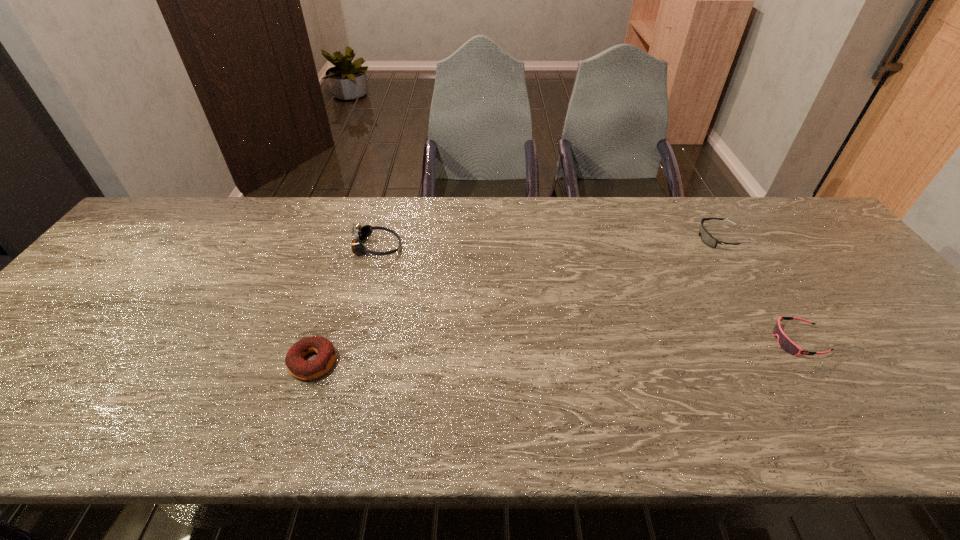
Locate an element on the screen. The width and height of the screenshot is (960, 540). free space between the doughnut and the leftmost goggles is located at coordinates (345, 305).

Identify the location of object that is the second nearest to the shortest goggles. (361, 232).

Where is `the second closest object to the tallest object`? This screenshot has height=540, width=960. the second closest object to the tallest object is located at coordinates (706, 237).

Where is `goggles that stands as the closest to the nearest goggles`? Image resolution: width=960 pixels, height=540 pixels. goggles that stands as the closest to the nearest goggles is located at coordinates pos(706,237).

At what (x,y) coordinates should I click in order to perform the action: click on goggles that stands as the closest to the tallest object. Please return your answer as a coordinate pair (x, y). This screenshot has width=960, height=540. Looking at the image, I should click on (706, 237).